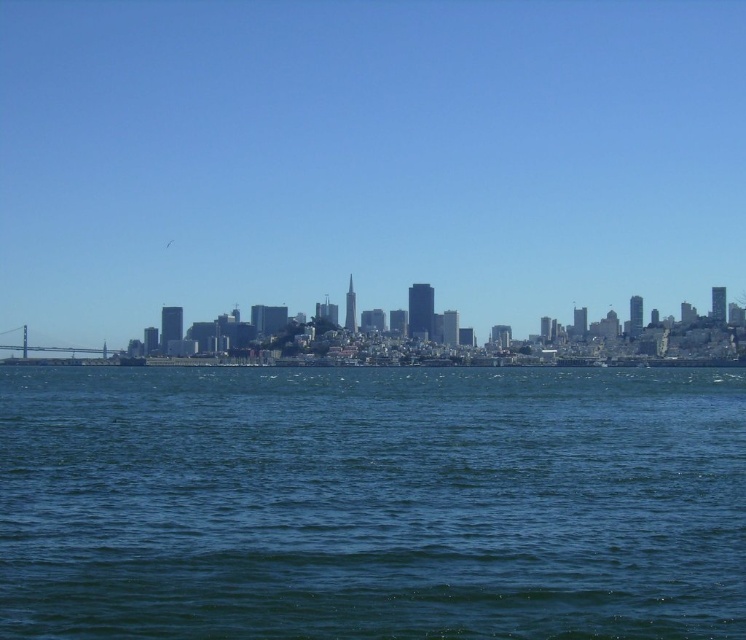
You are a city planner reviewing this image to assess space utilization in the city. Based on the scene, which object takes up more area in the image between the transparent glass skyscrapers at center and the blue liquid water at center?

The blue liquid water at center occupies more area than the transparent glass skyscrapers at center in the image.

You are standing on a pier overlooking the city skyline. You see the transparent glass skyscrapers at center and the blue liquid water at center. Which object is positioned to the right of the other?

The transparent glass skyscrapers at center is to the right of blue liquid water at center.

You are standing at the point marked as point [366,157] in the city skyline image. Looking around, you notice transparent glass skyscrapers at center. What direction should you face to see the transparent glass skyscrapers at center?

You are already facing the transparent glass skyscrapers at center because the point [366,157] corresponds to their location.